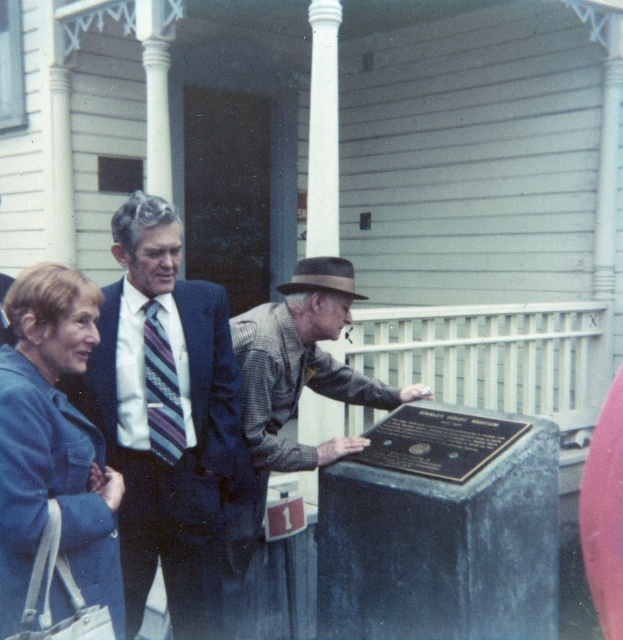
Is plaid shirt at center above bronze plaque at center?

No, plaid shirt at center is not above bronze plaque at center.

Can you confirm if plaid shirt at center is shorter than bronze plaque at center?

In fact, plaid shirt at center may be taller than bronze plaque at center.

Which is in front, point (277, 412) or point (520, 435)?

Point (520, 435) is more forward.

Locate an element on the screen. The width and height of the screenshot is (623, 640). plaid shirt at center is located at coordinates (295, 392).

Does striped tie at center have a smaller size compared to bronze plaque at center?

No.

From the picture: Is striped tie at center above bronze plaque at center?

Yes.

This screenshot has height=640, width=623. What do you see at coordinates (166, 419) in the screenshot?
I see `striped tie at center` at bounding box center [166, 419].

Locate an element on the screen. Image resolution: width=623 pixels, height=640 pixels. striped tie at center is located at coordinates (166, 419).

Is denim jacket at lower left behind plaid shirt at center?

That is False.

Between denim jacket at lower left and plaid shirt at center, which one appears on the left side from the viewer's perspective?

From the viewer's perspective, denim jacket at lower left appears more on the left side.

Between point (57, 602) and point (267, 314), which one is positioned in front?

Point (57, 602) is in front.

This screenshot has width=623, height=640. I want to click on denim jacket at lower left, so click(54, 444).